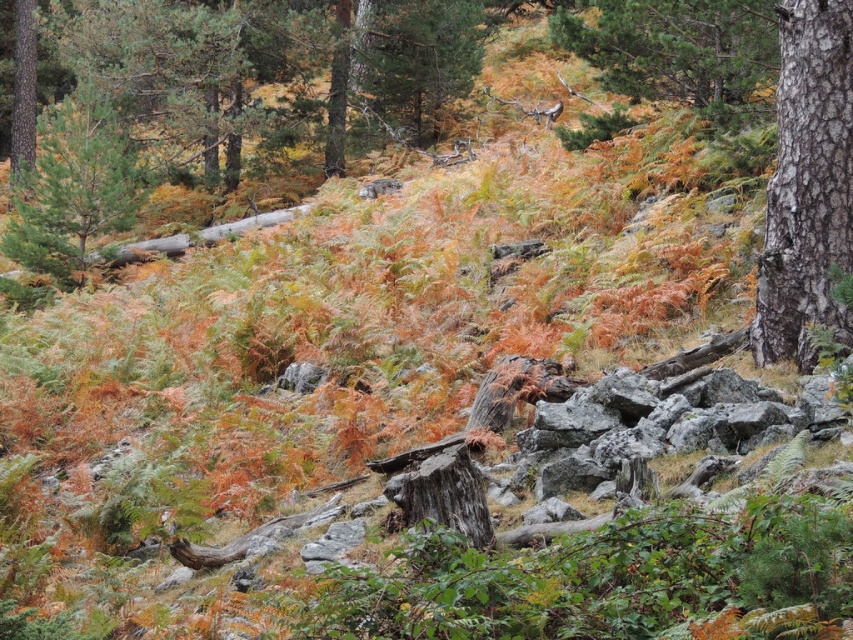
Question: In this image, where is smooth bark tree at right located relative to smooth brown tree trunk at left?

Choices:
 (A) left
 (B) right

Answer: (B)

Question: Among these objects, which one is nearest to the camera?

Choices:
 (A) green matte tree at left
 (B) smooth bark tree at right

Answer: (B)

Question: Which point is closer to the camera taking this photo?

Choices:
 (A) (840, 172)
 (B) (96, 227)

Answer: (A)

Question: Does smooth bark tree at right appear under brown rough tree trunk at upper center?

Choices:
 (A) no
 (B) yes

Answer: (B)

Question: Does green matte tree at left appear on the right side of smooth brown tree trunk at left?

Choices:
 (A) no
 (B) yes

Answer: (B)

Question: Which object is the farthest from the smooth bark tree at right?

Choices:
 (A) brown rough tree trunk at upper center
 (B) smooth brown tree trunk at left

Answer: (B)